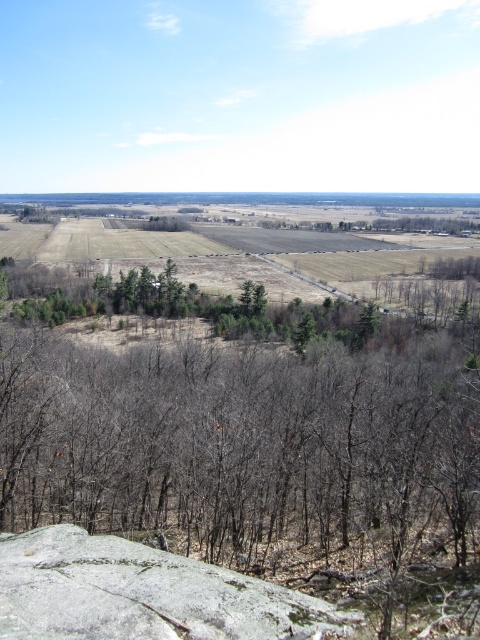
Question: Among these points, which one is farthest from the camera?

Choices:
 (A) (181, 556)
 (B) (360, 515)

Answer: (B)

Question: Is green matte trees at center positioned at the back of gray rough rock at center?

Choices:
 (A) no
 (B) yes

Answer: (B)

Question: Can you confirm if green matte trees at center is positioned to the right of gray rough rock at center?

Choices:
 (A) yes
 (B) no

Answer: (A)

Question: Which of the following is the closest to the observer?

Choices:
 (A) green matte trees at center
 (B) blue sky at upper center
 (C) gray rough rock at center

Answer: (C)

Question: Can you confirm if green matte trees at center is positioned above blue sky at upper center?

Choices:
 (A) no
 (B) yes

Answer: (A)

Question: Which object is the farthest from the gray rough rock at center?

Choices:
 (A) green matte trees at center
 (B) blue sky at upper center

Answer: (B)